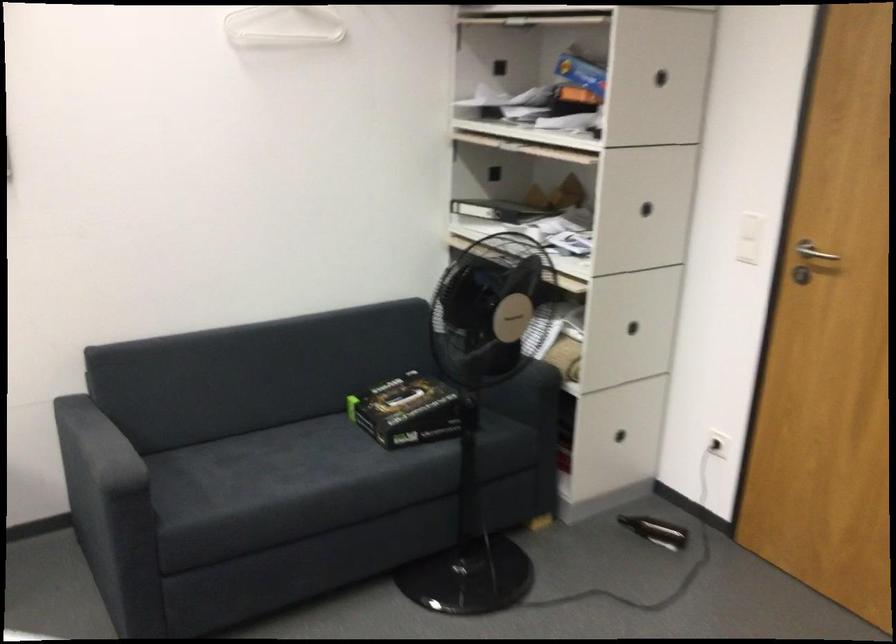
Identify the location of dark sofa armrest. The image size is (896, 644). (93, 440).